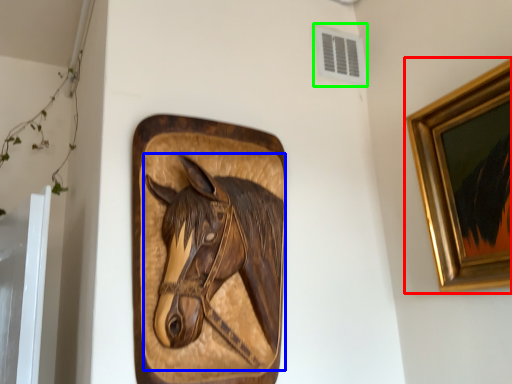
Question: Which object is positioned closest to picture frame (highlighted by a red box)? Select from horse (highlighted by a blue box) and air conditioning (highlighted by a green box).

Choices:
 (A) horse
 (B) air conditioning

Answer: (A)